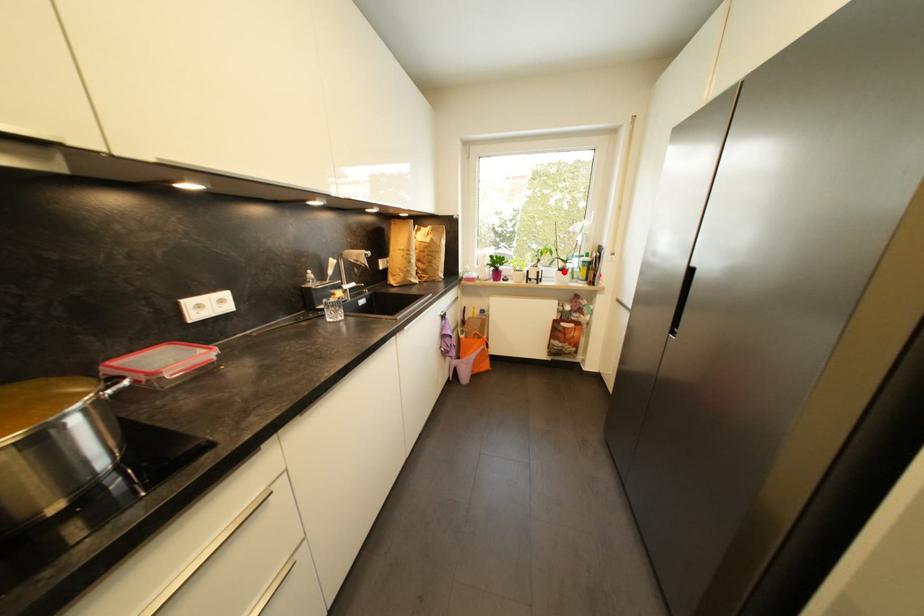
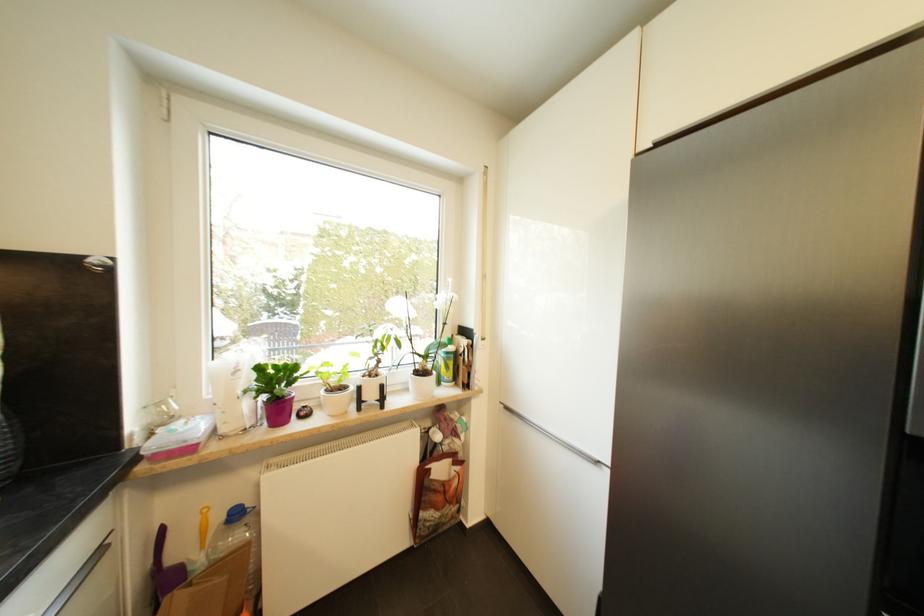
Question: I am providing you with two images of the same scene from different viewpoints. Given a red point in image1, look at the same physical point in image2. Is it:

Choices:
 (A) Closer to the viewpoint
 (B) Farther from the viewpoint

Answer: (B)